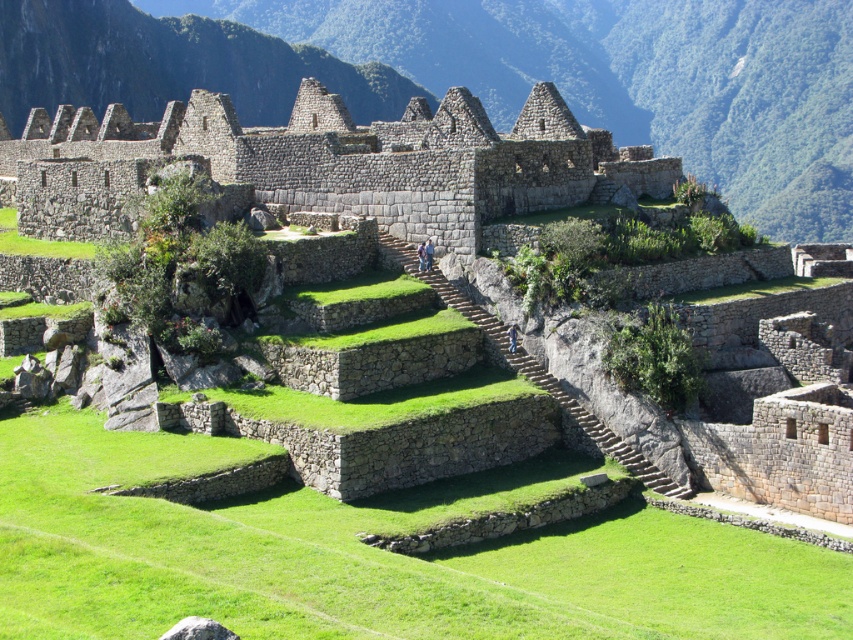
You are a hiker who has just arrived at Machu Picchu and wants to take a photo of both the natural stone ruins at center and the gray stone ruins at center. Which one should you focus on to ensure they both fit in the frame?

The natural stone ruins at center is bigger than the gray stone ruins at center, so you should focus on the natural stone ruins at center to ensure both fit in the frame.

You are a hiker standing at the base of Machu Picchu. You see the natural stone ruins at center and the gray stone ruins at center. Which set of ruins is closer to you?

The natural stone ruins at center is closer to you because it is further to the viewer than the gray stone ruins at center.

You are standing at the entrance of the Machu Picchu ruins and see the point marked at coordinates [491,74]. What is located at that point?

The point at coordinates [491,74] is occupied by natural stone ruins at center.